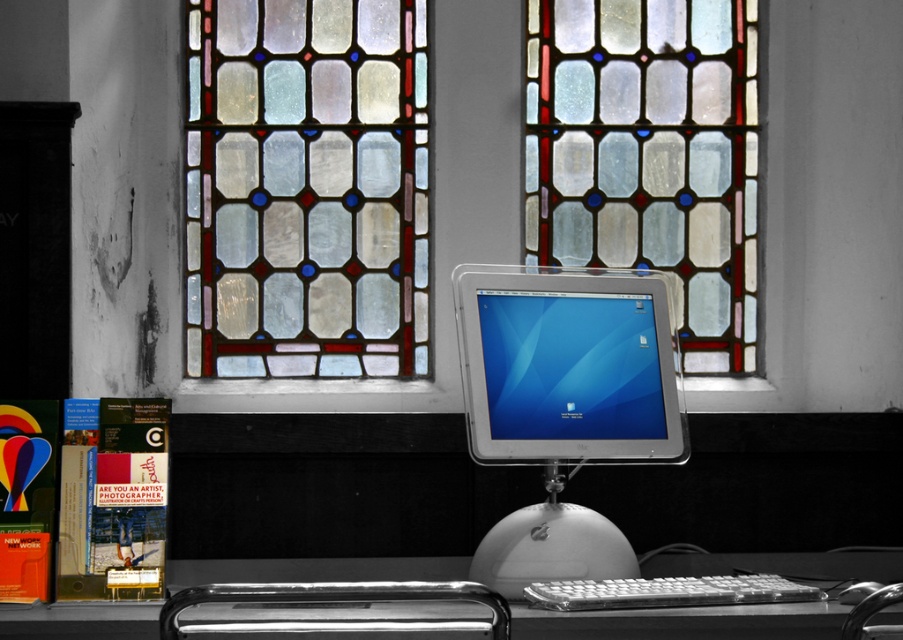
Question: In this image, where is stained glass window at upper center located relative to white plastic computer desk at center?

Choices:
 (A) left
 (B) right

Answer: (A)

Question: Can you confirm if stained glass window at upper center is positioned below white plastic keyboard at lower center?

Choices:
 (A) yes
 (B) no

Answer: (B)

Question: Considering the relative positions of stained glass window at upper center and white plastic mouse at center in the image provided, where is stained glass window at upper center located with respect to white plastic mouse at center?

Choices:
 (A) right
 (B) left

Answer: (B)

Question: Among these points, which one is farthest from the camera?

Choices:
 (A) (869, 593)
 (B) (734, 577)
 (C) (562, 44)

Answer: (C)

Question: Which object appears farthest from the camera in this image?

Choices:
 (A) stained glass window at upper center
 (B) stained glass at upper center

Answer: (B)

Question: Estimate the real-world distances between objects in this image. Which object is closer to the white plastic keyboard at lower center?

Choices:
 (A) white plastic computer desk at center
 (B) white plastic mouse at center
 (C) stained glass window at upper center

Answer: (A)